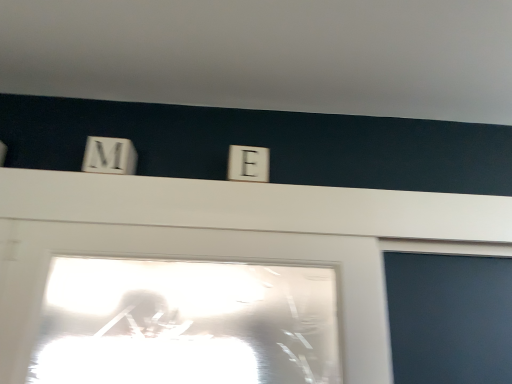
Question: In terms of height, does white plastic letter e at center look taller or shorter compared to white wooden letter m at upper left?

Choices:
 (A) tall
 (B) short

Answer: (B)

Question: Based on their sizes in the image, would you say white plastic letter e at center is bigger or smaller than white wooden letter m at upper left?

Choices:
 (A) big
 (B) small

Answer: (A)

Question: Is white plastic letter e at center inside or outside of white wooden letter m at upper left?

Choices:
 (A) inside
 (B) outside

Answer: (B)

Question: Relative to white plastic letter e at center, is white wooden letter m at upper left in front or behind?

Choices:
 (A) front
 (B) behind

Answer: (A)

Question: Considering the positions of white wooden letter m at upper left and white plastic letter e at center in the image, is white wooden letter m at upper left bigger or smaller than white plastic letter e at center?

Choices:
 (A) big
 (B) small

Answer: (B)

Question: From the image's perspective, is white wooden letter m at upper left located above or below white plastic letter e at center?

Choices:
 (A) above
 (B) below

Answer: (A)

Question: Would you say white wooden letter m at upper left is inside or outside white plastic letter e at center?

Choices:
 (A) outside
 (B) inside

Answer: (A)